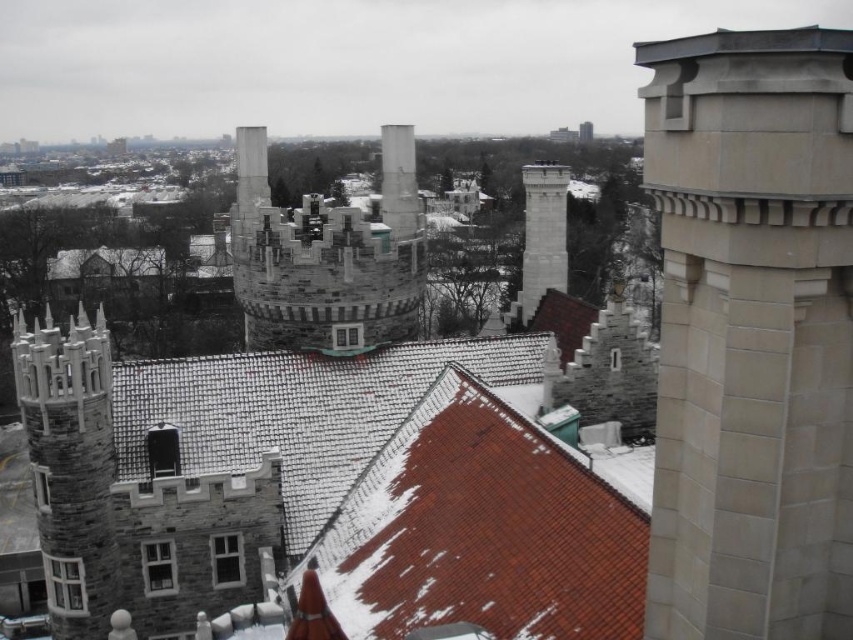
Based on the photo, which is more to the right, red shingles at center or stone chimney at center-left?

Positioned to the right is red shingles at center.

Between point (409, 548) and point (38, 406), which one is positioned in front?

Point (409, 548)

Image resolution: width=853 pixels, height=640 pixels. Identify the location of red shingles at center. (480, 529).

Does point (318, 257) lie in front of point (543, 246)?

That is True.

Which is behind, point (331, 340) or point (524, 284)?

Point (524, 284)

The width and height of the screenshot is (853, 640). In order to click on stone brick castle at center in this screenshot , I will do `click(328, 257)`.

Does red shingles at center come behind stone brick castle at center?

That is False.

Measure the distance between red shingles at center and stone brick castle at center.

18.54 meters

Locate an element on the screen. red shingles at center is located at coordinates (480, 529).